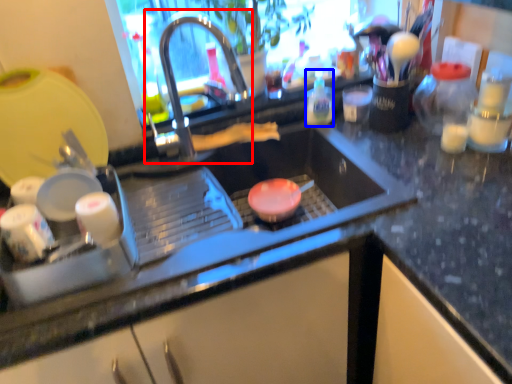
Question: Which object appears farthest to the camera in this image, tap (highlighted by a red box) or bottle (highlighted by a blue box)?

Choices:
 (A) tap
 (B) bottle

Answer: (B)